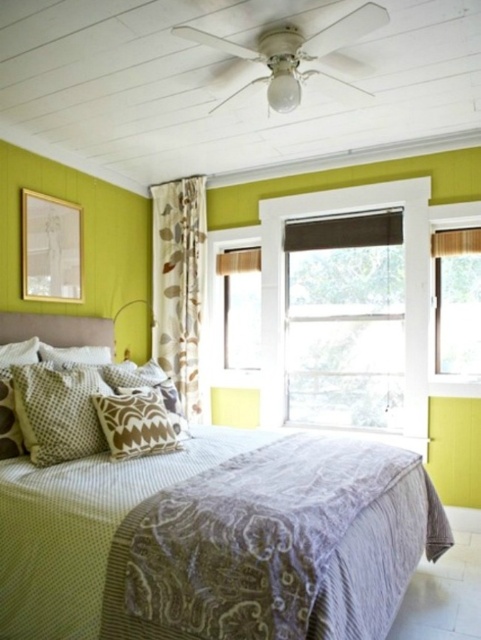
Can you confirm if textured beige bed at center is bigger than patterned fabric pillow at center?

Correct, textured beige bed at center is larger in size than patterned fabric pillow at center.

Is textured beige bed at center above patterned fabric pillow at center?

Actually, textured beige bed at center is below patterned fabric pillow at center.

What are the coordinates of `textured beige bed at center` in the screenshot? It's located at (204, 529).

Where is `textured beige bed at center`? Image resolution: width=481 pixels, height=640 pixels. textured beige bed at center is located at coordinates (204, 529).

Who is higher up, textured beige bed at center or matte brown curtain at right?

matte brown curtain at right is higher up.

Describe the element at coordinates (204, 529) in the screenshot. I see `textured beige bed at center` at that location.

The image size is (481, 640). Describe the element at coordinates (204, 529) in the screenshot. I see `textured beige bed at center` at that location.

At what (x,y) coordinates should I click in order to perform the action: click on textured beige bed at center. Please return your answer as a coordinate pair (x, y). Looking at the image, I should click on (204, 529).

In the scene shown: Is textured beige bed at center further to camera compared to brown textured pillow at center?

No, textured beige bed at center is in front of brown textured pillow at center.

Which is below, textured beige bed at center or brown textured pillow at center?

textured beige bed at center

The width and height of the screenshot is (481, 640). What do you see at coordinates (204, 529) in the screenshot?
I see `textured beige bed at center` at bounding box center [204, 529].

This screenshot has height=640, width=481. I want to click on textured beige bed at center, so click(204, 529).